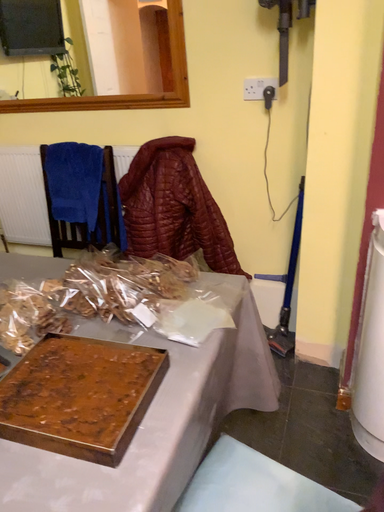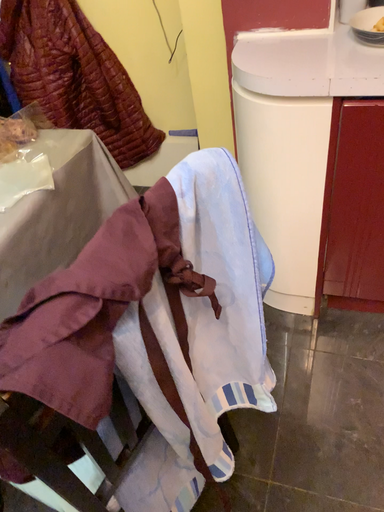
Question: Which way did the camera rotate in the video?

Choices:
 (A) rotated downward
 (B) rotated upward

Answer: (A)